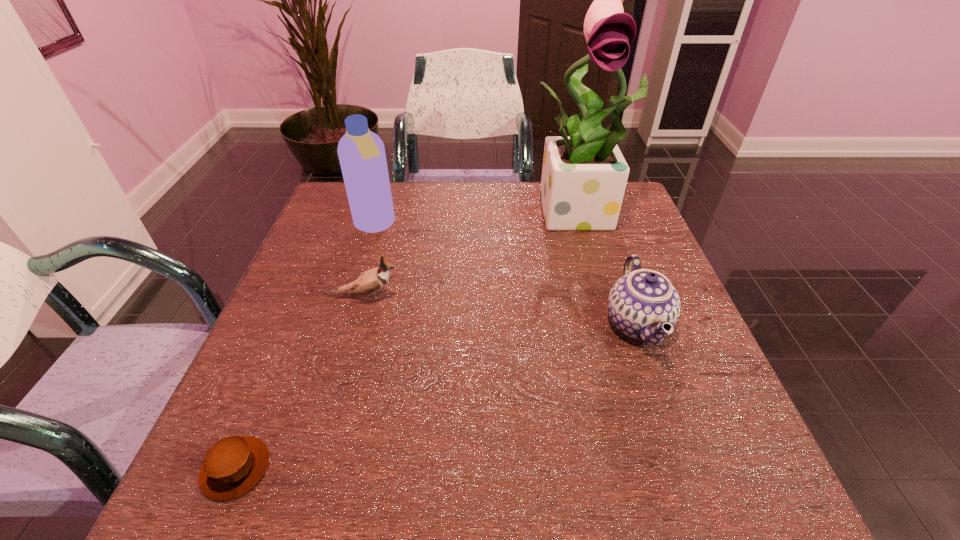
Where is `chinaware that is at the right edge`? chinaware that is at the right edge is located at coordinates (643, 304).

You are a GUI agent. You are given a task and a screenshot of the screen. Output one action in this format:
    pyautogui.click(x=<x>, y=<y>)
    Task: Click on the object that is positioned at the far left corner
    
    Given the screenshot: What is the action you would take?
    (x=361, y=152)

The image size is (960, 540). Find the location of `object at the near left corner`. object at the near left corner is located at coordinates (234, 465).

Image resolution: width=960 pixels, height=540 pixels. I want to click on object present at the far right corner, so click(x=584, y=175).

This screenshot has height=540, width=960. In the image, there is a desktop. Identify the location of blank space at the far edge. (420, 187).

You are a GUI agent. You are given a task and a screenshot of the screen. Output one action in this format:
    pyautogui.click(x=<x>, y=<y>)
    Task: Click on the vacant space at the left edge of the desktop
    The width and height of the screenshot is (960, 540).
    Given the screenshot: What is the action you would take?
    pyautogui.click(x=299, y=272)

This screenshot has width=960, height=540. Find the location of `free region at the right edge`. free region at the right edge is located at coordinates (649, 249).

The image size is (960, 540). In the image, there is a desktop. Identify the location of blank space at the far left corner. (338, 197).

Where is `free space between the shortest object and the second tallest object`? The width and height of the screenshot is (960, 540). free space between the shortest object and the second tallest object is located at coordinates (305, 347).

Image resolution: width=960 pixels, height=540 pixels. I want to click on empty location between the tallest object and the bird, so click(472, 253).